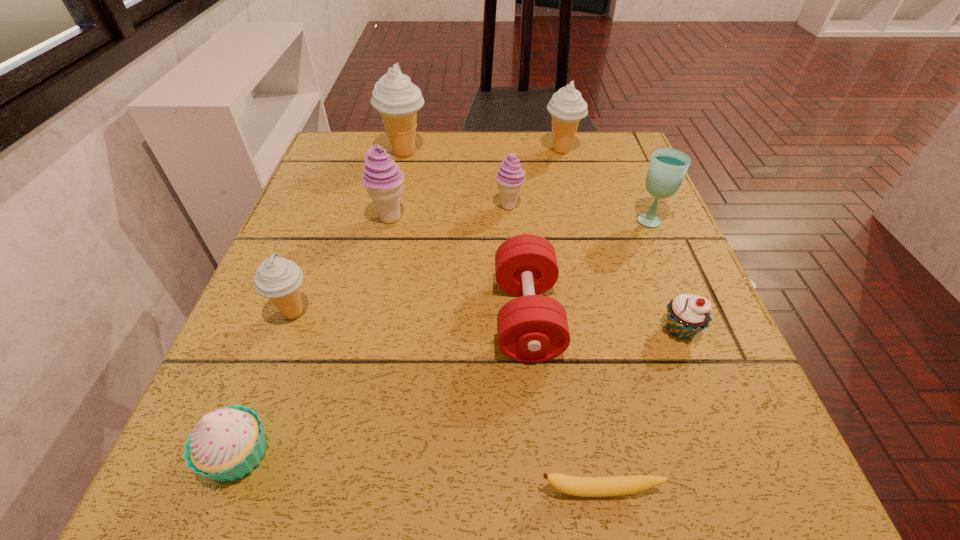
Locate an element on the screen. This screenshot has width=960, height=540. vacant space that is in between the shortest object and the glass is located at coordinates (625, 355).

Where is `vacant space that is in between the dumbbell and the rightmost beige icecream`? This screenshot has width=960, height=540. vacant space that is in between the dumbbell and the rightmost beige icecream is located at coordinates (544, 234).

The height and width of the screenshot is (540, 960). I want to click on free area in between the yellow banana and the left purple icecream, so click(x=494, y=355).

I want to click on free space between the biggest beige icecream and the second biggest beige icecream, so click(483, 152).

You are a GUI agent. You are given a task and a screenshot of the screen. Output one action in this format:
    pyautogui.click(x=<x>, y=<y>)
    Task: Click on the vacant area that lies between the banana and the glass
    The image size is (960, 540).
    Given the screenshot: What is the action you would take?
    pyautogui.click(x=625, y=355)

Identify the location of vacant area between the rightmost icecream and the tallest object. (483, 152).

Locate an element on the screen. This screenshot has width=960, height=540. object that stands as the seventh closest to the yellow banana is located at coordinates (510, 176).

Identify which object is the fifth nearest to the yellow banana. Please provide its 2D coordinates. Your answer should be formatted as a tuple, i.e. [(x, y)], where the tuple contains the x and y coordinates of a point satisfying the conditions above.

[(668, 167)]

Identify which icecream is located as the third nearest to the leftmost beige icecream. Please provide its 2D coordinates. Your answer should be formatted as a tuple, i.e. [(x, y)], where the tuple contains the x and y coordinates of a point satisfying the conditions above.

[(395, 97)]

Identify which icecream is the closest to the second icecream from right to left. Please provide its 2D coordinates. Your answer should be formatted as a tuple, i.e. [(x, y)], where the tuple contains the x and y coordinates of a point satisfying the conditions above.

[(567, 107)]